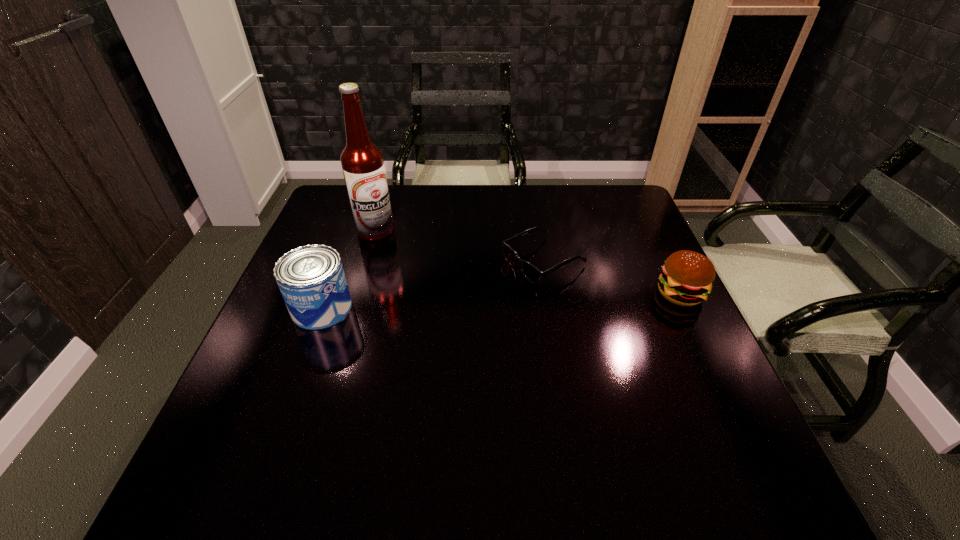
In order to click on the third shortest object in this screenshot , I will do `click(311, 278)`.

Where is `the rightmost object`? This screenshot has width=960, height=540. the rightmost object is located at coordinates (687, 277).

Locate an element on the screen. This screenshot has width=960, height=540. the third tallest object is located at coordinates (687, 277).

The image size is (960, 540). Identify the location of the third object from left to right. (533, 274).

Find the location of a particular element. the shortest object is located at coordinates (533, 274).

Image resolution: width=960 pixels, height=540 pixels. I want to click on alcohol, so click(362, 162).

In order to click on vacant space located on the front label of the can in this screenshot , I will do `click(397, 308)`.

Find the location of a particular element. The image size is (960, 540). vacant space located on the front of the hamburger is located at coordinates (702, 337).

The image size is (960, 540). Identify the location of vacant region located at the front lenses of the sunglasses. (469, 297).

Identify the location of vacant space located 0.080m at the front lenses of the sunglasses. The width and height of the screenshot is (960, 540). (486, 289).